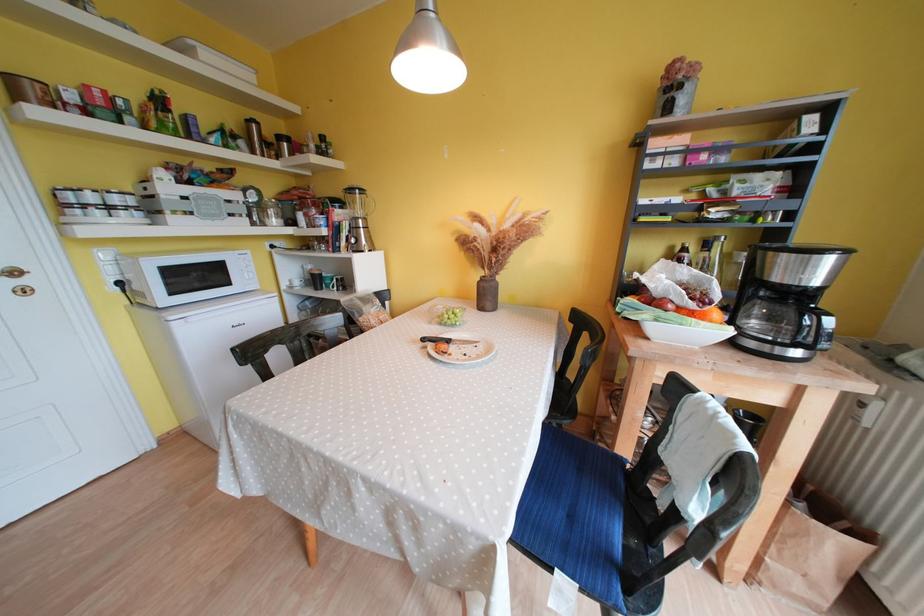
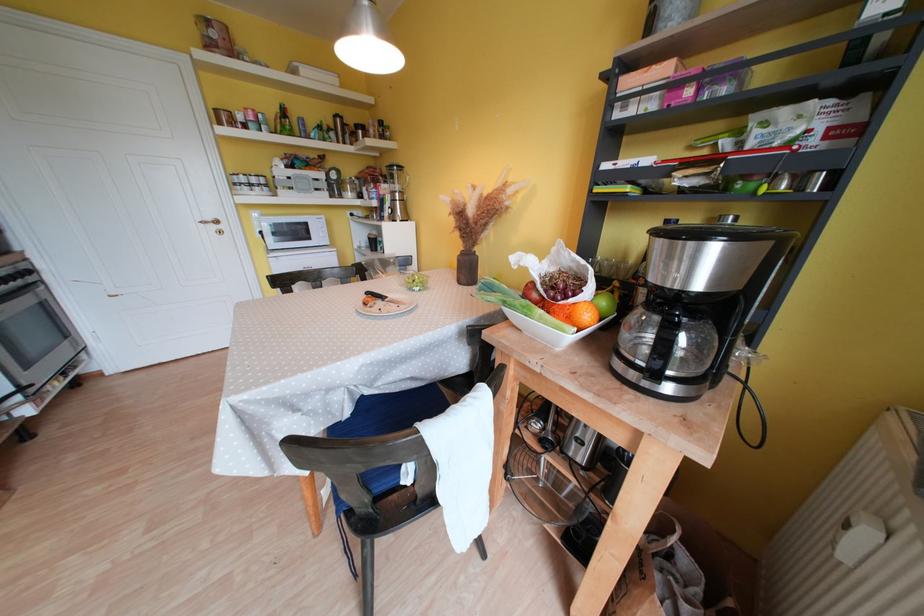
The point at (677, 310) is marked in the first image. Where is the corresponding point in the second image?

(541, 299)